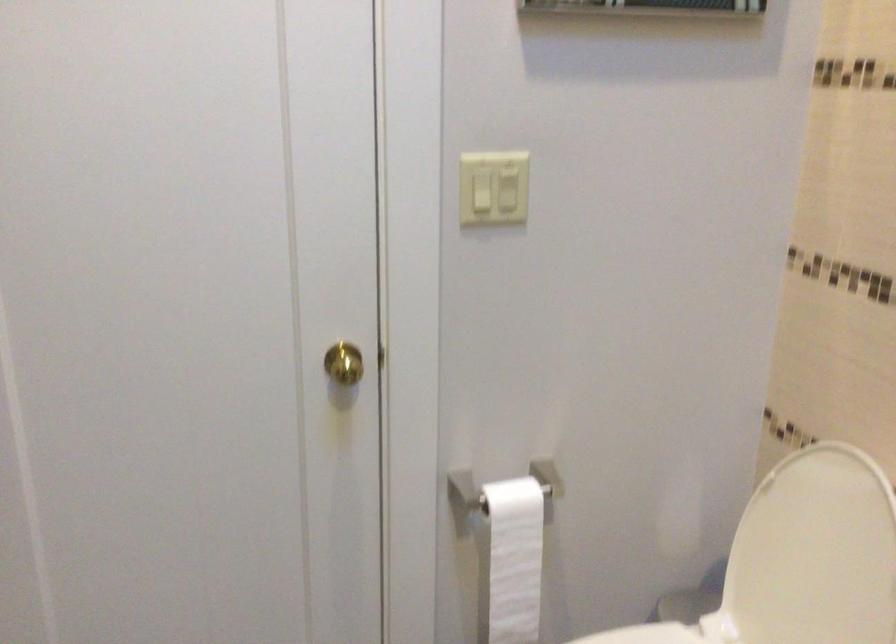
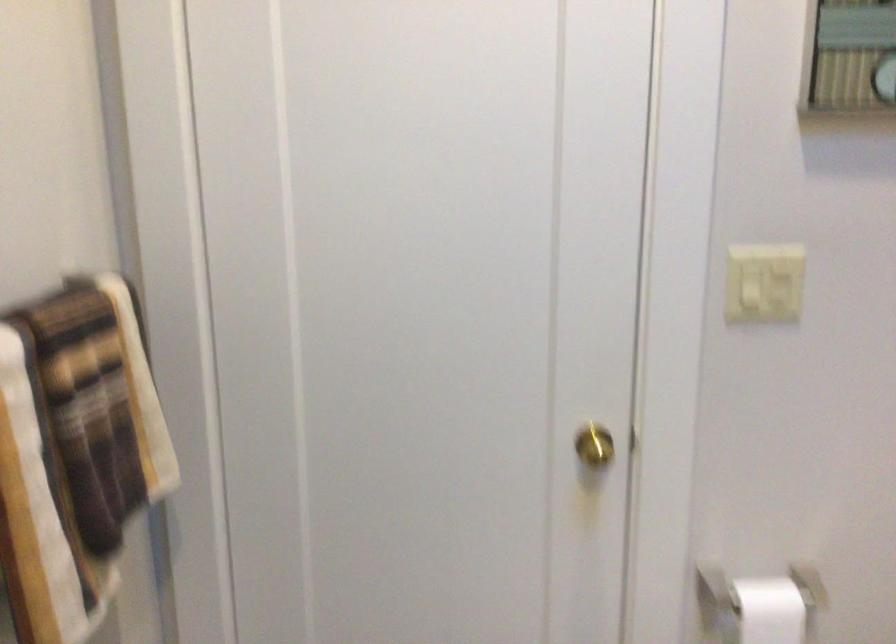
Question: The camera is either moving clockwise (left) or counter-clockwise (right) around the object. The first image is from the beginning of the video and the second image is from the end. Is the camera moving left or right when shooting the video?

Choices:
 (A) Left
 (B) Right

Answer: (B)